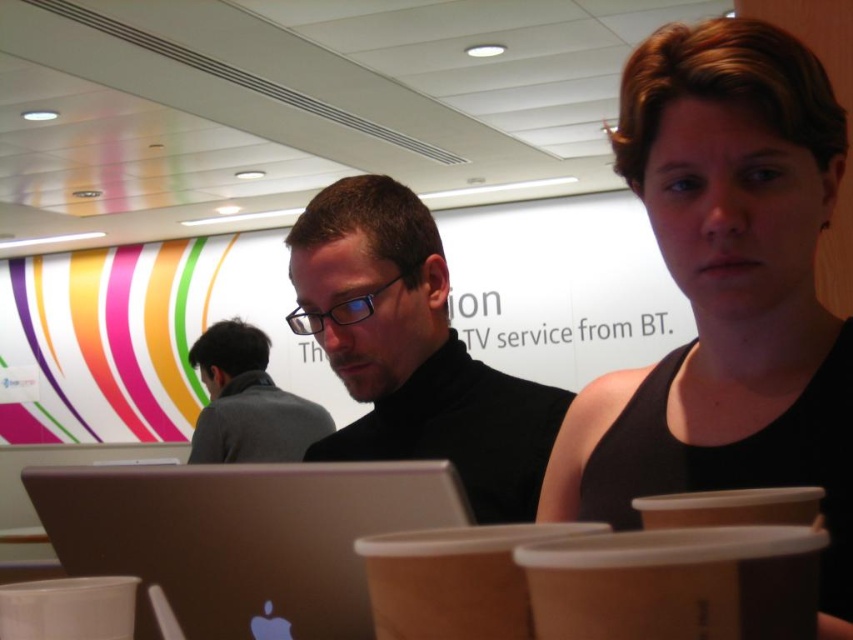
You are a person with a 18 inch long ruler. You want to measure the distance between yourself and the satin silver laptop at lower left. Can you reach it with your ruler?

The satin silver laptop at lower left is 21.92 inches away from the viewer. Since the ruler is only 18 inches long, it cannot reach the full distance to the laptop.

In the scene shown: You are standing in the indoor space shown in the image. There are two points marked in the scene, one at coordinates point (775,72) and another at point (21,582). Which of these points is nearer to you?

Point (775,72) is closer to the viewer than point (21,582).